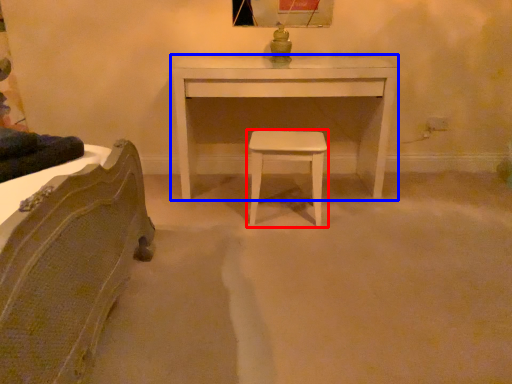
Question: Which of the following is the closest to the observer, stool (highlighted by a red box) or table (highlighted by a blue box)?

Choices:
 (A) stool
 (B) table

Answer: (A)